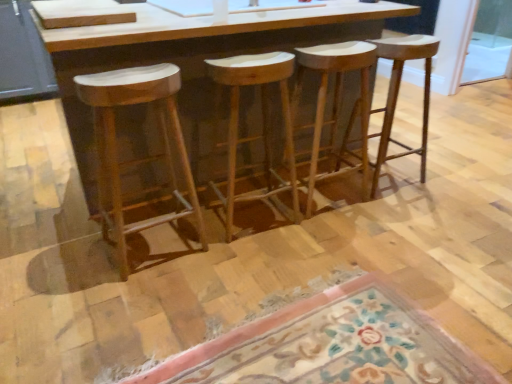
This screenshot has height=384, width=512. Identify the location of vacant space in front of natural wood stool at left, which is counted as the fourth stool, starting from the right. (133, 299).